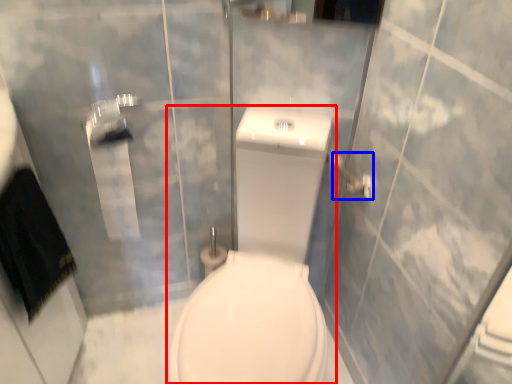
Question: Which point is closer to the camera, porcelain (highlighted by a red box) or towel bar (highlighted by a blue box)?

Choices:
 (A) porcelain
 (B) towel bar

Answer: (A)